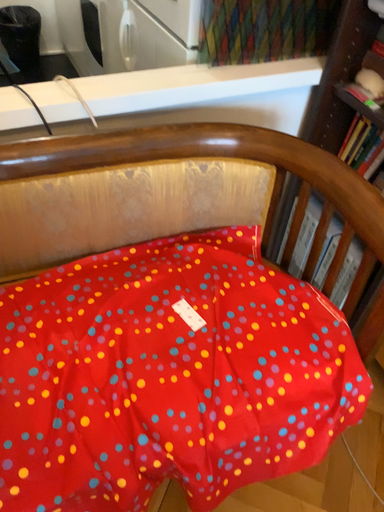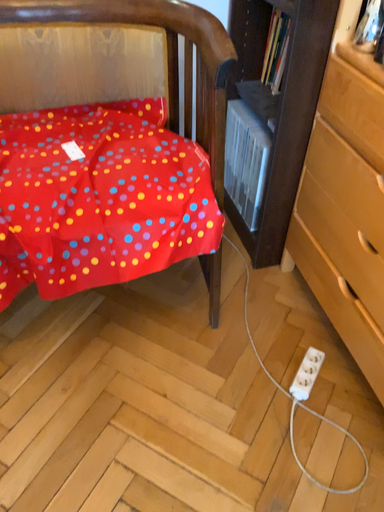
Question: How did the camera likely rotate when shooting the video?

Choices:
 (A) rotated right
 (B) rotated left

Answer: (B)